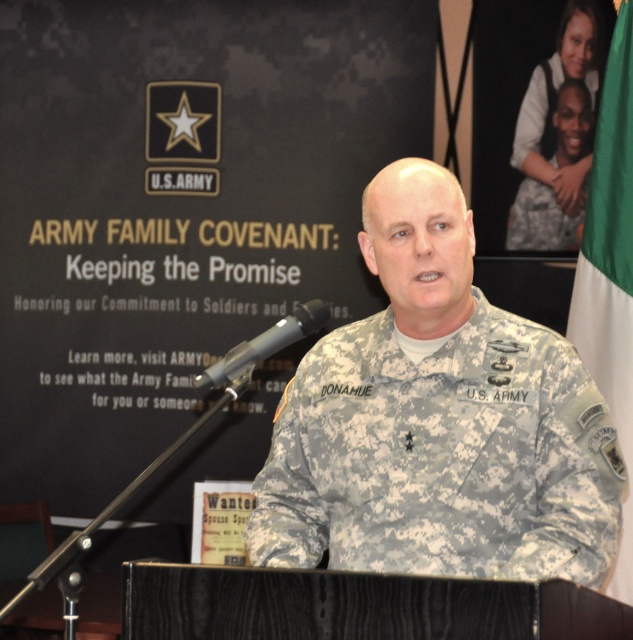
Does green fabric flag at right appear under camouflage uniform at upper right?

Yes.

Who is positioned more to the right, green fabric flag at right or camouflage uniform at upper right?

camouflage uniform at upper right

Who is more forward, [601,109] or [555,120]?

Point [601,109]

You are a GUI agent. You are given a task and a screenshot of the screen. Output one action in this format:
    pyautogui.click(x=<x>, y=<y>)
    Task: Click on the green fabric flag at right
    The image size is (633, 640).
    Given the screenshot: What is the action you would take?
    pyautogui.click(x=610, y=273)

Is camouflage fabric uniform at center shorter than camouflage uniform at upper right?

Correct, camouflage fabric uniform at center is not as tall as camouflage uniform at upper right.

Between camouflage fabric uniform at center and camouflage uniform at upper right, which one has more height?

With more height is camouflage uniform at upper right.

Measure the distance between point (510, 465) and camera.

Point (510, 465) is 7.75 feet away from camera.

The image size is (633, 640). What are the coordinates of `camouflage fabric uniform at center` in the screenshot? It's located at (442, 458).

Who is lower down, camouflage fabric uniform at center or green fabric flag at right?

camouflage fabric uniform at center

Can you confirm if camouflage fabric uniform at center is shorter than green fabric flag at right?

Indeed, camouflage fabric uniform at center has a lesser height compared to green fabric flag at right.

Find the location of a particular element. This screenshot has height=640, width=633. camouflage fabric uniform at center is located at coordinates (442, 458).